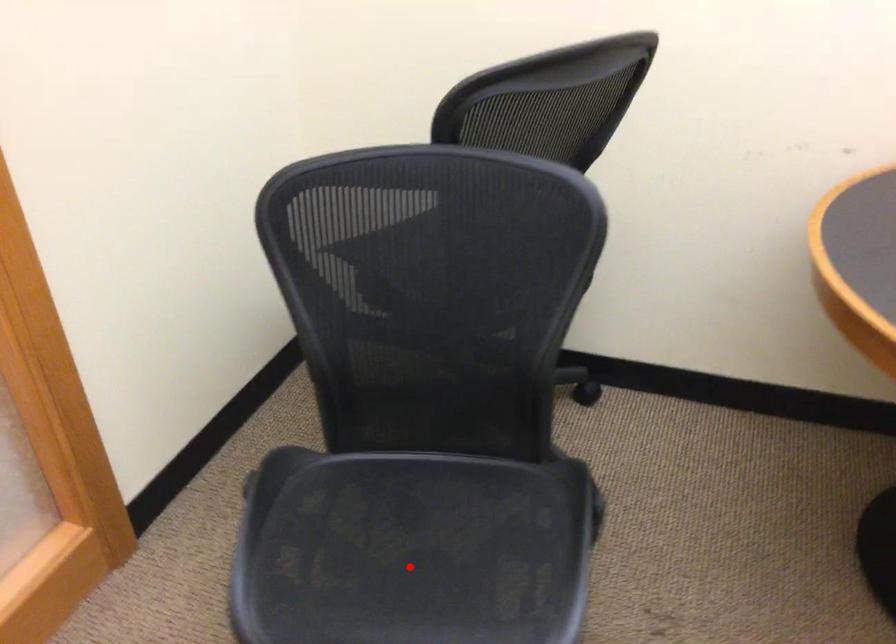
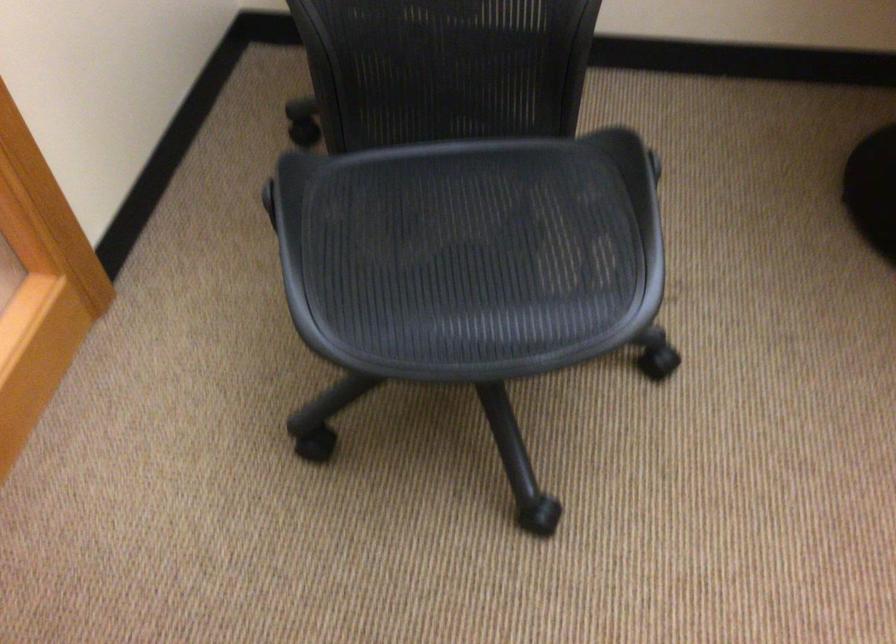
In the second image, find the point that corresponds to the highlighted location in the first image.

(470, 254)